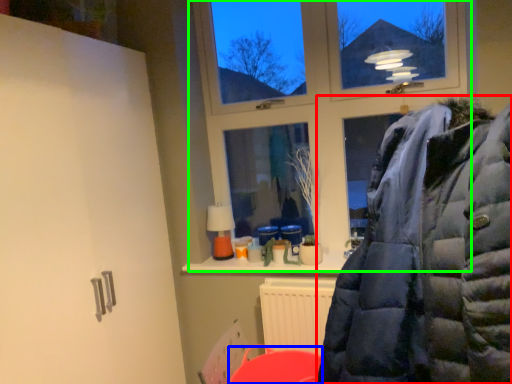
Question: Which object is positioned closest to jacket (highlighted by a red box)? Select from table (highlighted by a blue box) and window (highlighted by a green box).

Choices:
 (A) table
 (B) window

Answer: (A)